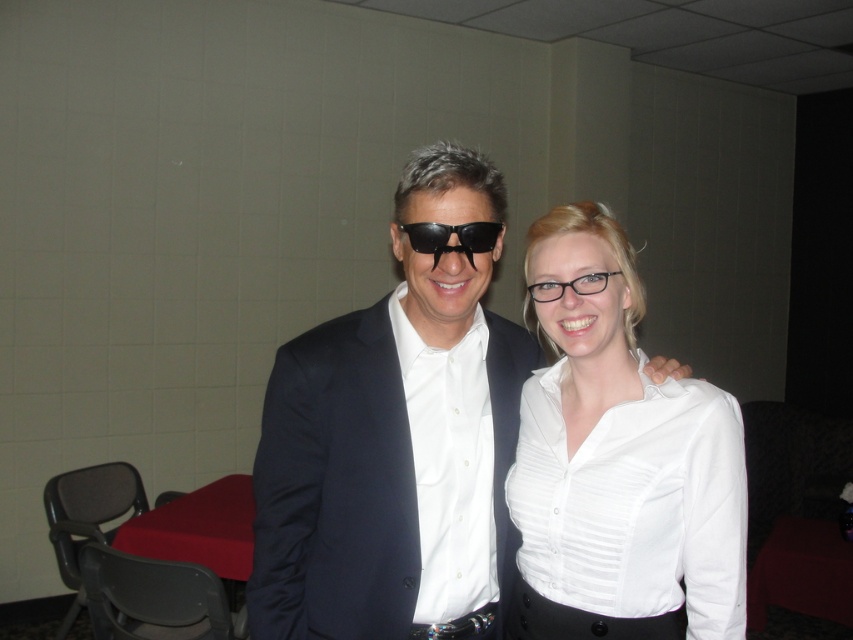
You are a photographer setting up for a group photo. You notice two items in the scene that might interfere with the background. The white glossy shirt at center and the satin black suit at center. Which of these items is smaller and might be easier to adjust if needed?

The white glossy shirt at center is smaller than the satin black suit at center, so it might be easier to adjust.

You are a photographer at an event and need to ensure that both the matte black suit at center and the satin black suit at center are visible in your portrait. Given their height difference, which suit should you position closer to the camera to maintain their visibility?

The matte black suit at center is taller than the satin black suit at center, so positioning the satin black suit at center closer to the camera would help balance their visibility in the portrait.

You are a photographer setting up for a group photo. You have a camera with a 1.2 meter focal length lens. The satin black suit at center and the black plastic sunglasses at center are both in the frame. Considering their sizes, which object would appear larger in the photo?

The satin black suit at center would appear larger in the photo because it is much taller than the black plastic sunglasses at center.